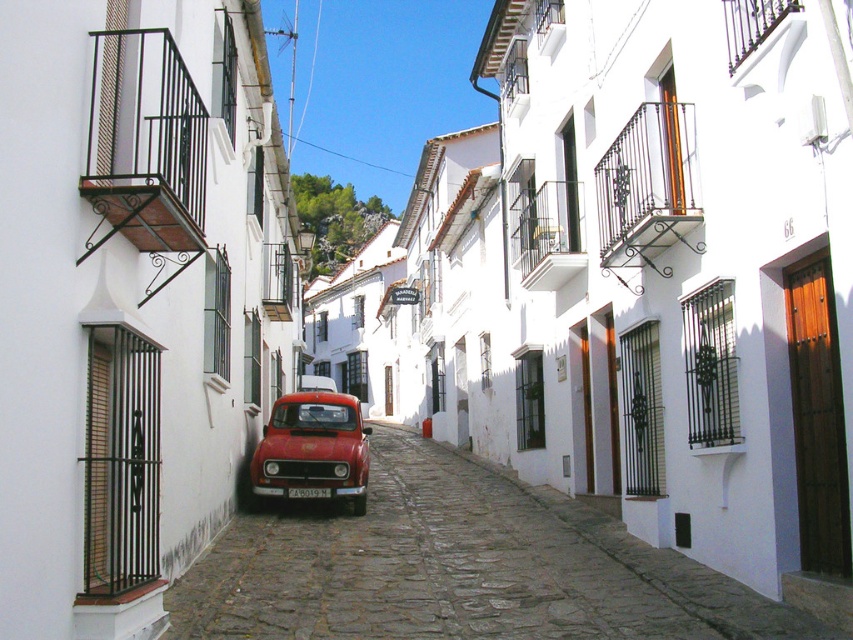
Who is more forward, [701,612] or [305,408]?

Point [701,612]

Between point (421, 481) and point (332, 406), which one is positioned behind?

The point (421, 481) is more distant.

Between point (544, 504) and point (283, 412), which one is positioned behind?

Point (283, 412)

Find the location of `metallic red car at center`. metallic red car at center is located at coordinates (457, 566).

Can you confirm if matte red car at center is bigger than white plastic license plate at center?

Yes, matte red car at center is bigger than white plastic license plate at center.

Does matte red car at center appear on the left side of white plastic license plate at center?

Incorrect, matte red car at center is not on the left side of white plastic license plate at center.

Which is behind, point (341, 403) or point (314, 493)?

The point (341, 403) is more distant.

Find the location of a particular element. matte red car at center is located at coordinates (312, 448).

Is point (318, 576) more distant than point (296, 492)?

No, (318, 576) is closer to viewer.

Which of these two, metallic red car at center or white plastic license plate at center, stands shorter?

With less height is white plastic license plate at center.

Is point (276, 541) closer to viewer compared to point (318, 496)?

That is True.

Identify the location of metallic red car at center. (457, 566).